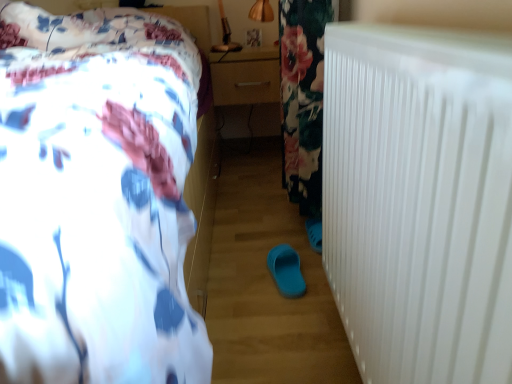
Question: Is white floral bedspread at upper left outside matte wood drawer at center?

Choices:
 (A) no
 (B) yes

Answer: (B)

Question: Considering the relative positions of white floral bedspread at upper left and matte wood drawer at center in the image provided, is white floral bedspread at upper left to the right of matte wood drawer at center from the viewer's perspective?

Choices:
 (A) yes
 (B) no

Answer: (B)

Question: Can you confirm if white floral bedspread at upper left is taller than matte wood drawer at center?

Choices:
 (A) no
 (B) yes

Answer: (B)

Question: Does white floral bedspread at upper left appear on the left side of matte wood drawer at center?

Choices:
 (A) no
 (B) yes

Answer: (B)

Question: Could you tell me if white floral bedspread at upper left is facing matte wood drawer at center?

Choices:
 (A) no
 (B) yes

Answer: (A)

Question: Does white floral bedspread at upper left touch matte wood drawer at center?

Choices:
 (A) yes
 (B) no

Answer: (B)

Question: From the image's perspective, would you say matte wood drawer at center is shown under white plastic radiator at right?

Choices:
 (A) no
 (B) yes

Answer: (A)

Question: Considering the relative sizes of matte wood drawer at center and white plastic radiator at right in the image provided, is matte wood drawer at center thinner than white plastic radiator at right?

Choices:
 (A) no
 (B) yes

Answer: (A)

Question: Can you confirm if matte wood drawer at center is shorter than white plastic radiator at right?

Choices:
 (A) no
 (B) yes

Answer: (B)

Question: Is matte wood drawer at center to the left of white plastic radiator at right from the viewer's perspective?

Choices:
 (A) yes
 (B) no

Answer: (A)

Question: Is matte wood drawer at center beside white plastic radiator at right?

Choices:
 (A) yes
 (B) no

Answer: (B)

Question: Can you confirm if matte wood drawer at center is smaller than white plastic radiator at right?

Choices:
 (A) no
 (B) yes

Answer: (B)

Question: Does blue rubber slipper at center come behind matte wood drawer at center?

Choices:
 (A) yes
 (B) no

Answer: (B)